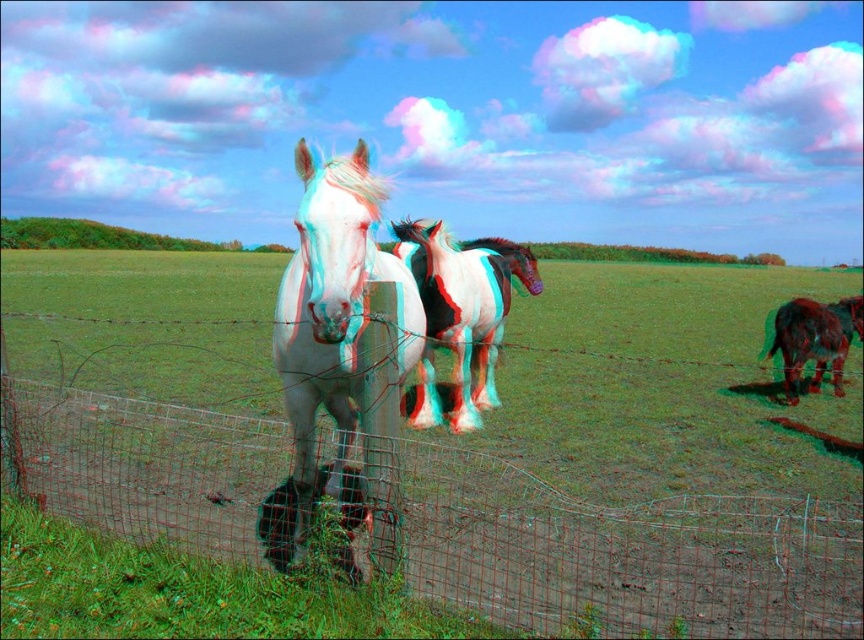
Question: In this image, where is metal wire fence at lower center located relative to shiny brown horse at right?

Choices:
 (A) above
 (B) below

Answer: (B)

Question: Does metal wire fence at lower center lie behind white glossy horse at center?

Choices:
 (A) yes
 (B) no

Answer: (A)

Question: Based on their relative distances, which object is nearer to the speckled paint horse at center?

Choices:
 (A) white glossy horse at center
 (B) shiny brown horse at right
 (C) metal wire fence at lower center

Answer: (A)

Question: Estimate the real-world distances between objects in this image. Which object is farther from the white glossy horse at center?

Choices:
 (A) metal wire fence at lower center
 (B) speckled paint horse at center
 (C) shiny brown horse at right

Answer: (C)

Question: Which point appears farthest from the camera in this image?

Choices:
 (A) (417, 269)
 (B) (842, 332)
 (C) (217, 454)

Answer: (B)

Question: Can you confirm if metal wire fence at lower center is bigger than shiny brown horse at right?

Choices:
 (A) yes
 (B) no

Answer: (B)